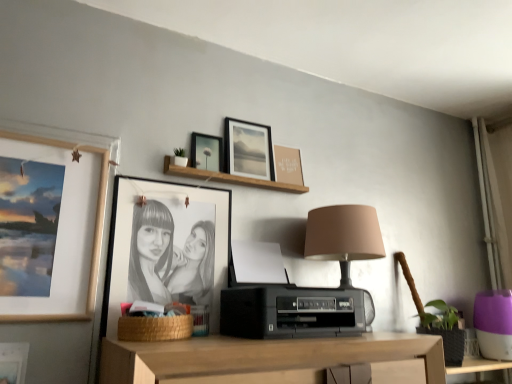
What are the coordinates of `vacant space situated above wooden shelf at upper center (from a real-world perspective)` in the screenshot? It's located at (234, 172).